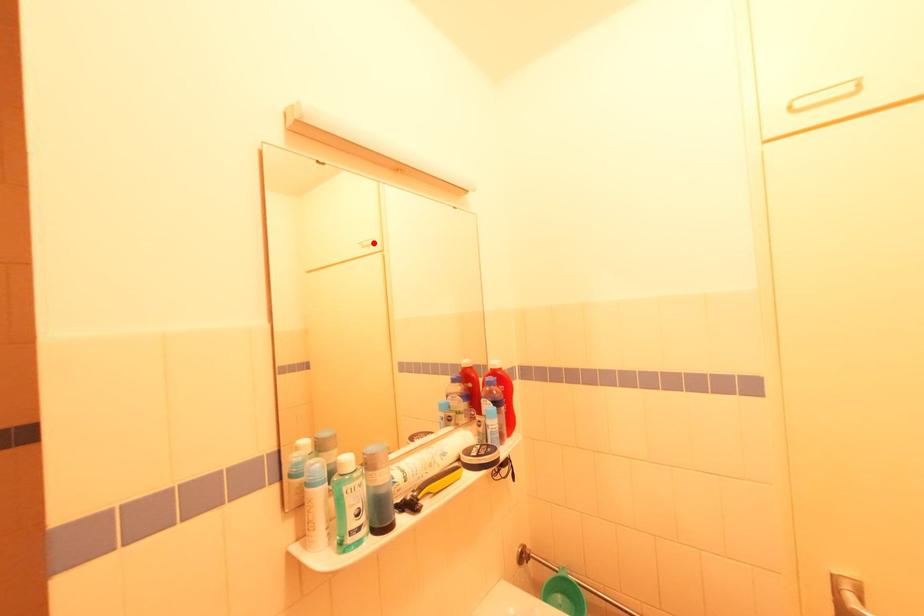
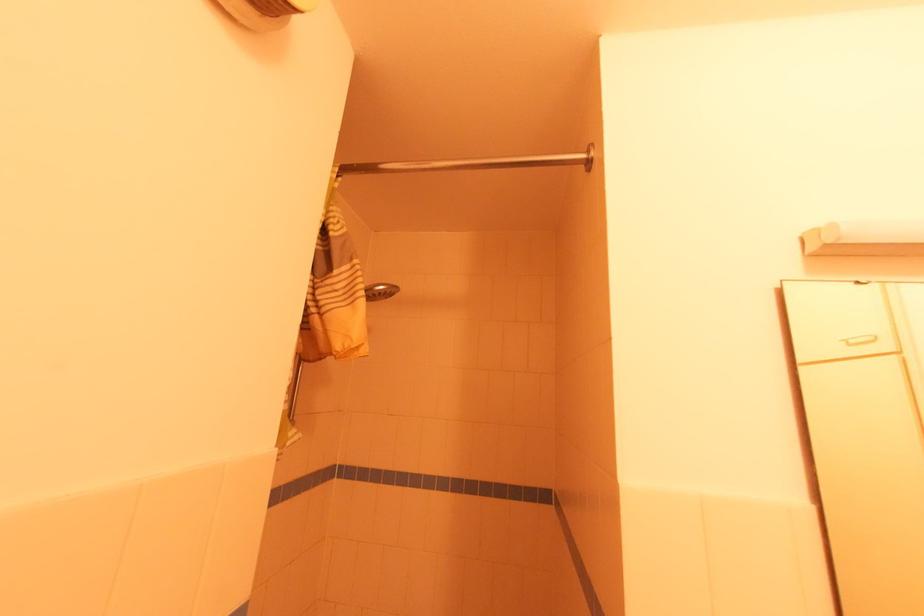
Locate, in the second image, the point that corresponds to the highlighted location in the first image.

(871, 339)